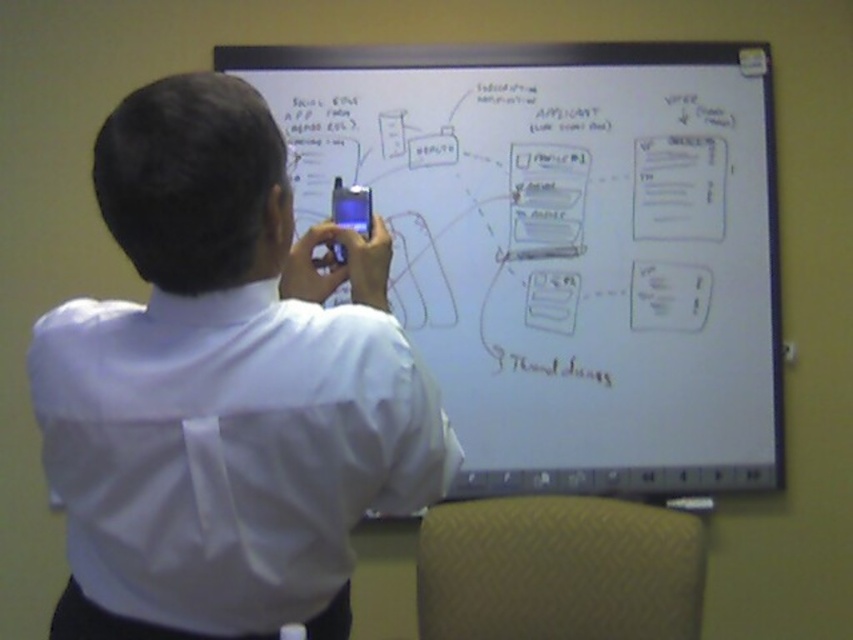
Can you confirm if whiteboard at upper center is taller than white smooth shirt at upper left?

Indeed, whiteboard at upper center has a greater height compared to white smooth shirt at upper left.

Is point (496, 397) more distant than point (236, 364)?

That is True.

Image resolution: width=853 pixels, height=640 pixels. Identify the location of whiteboard at upper center. (566, 246).